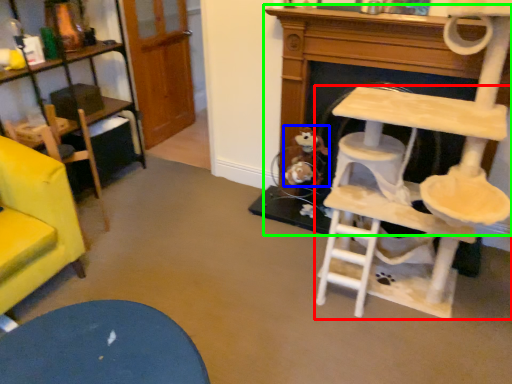
Question: Which is nearer to the table (highlighted by a red box)? toy (highlighted by a blue box) or fireplace (highlighted by a green box).

Choices:
 (A) toy
 (B) fireplace

Answer: (B)